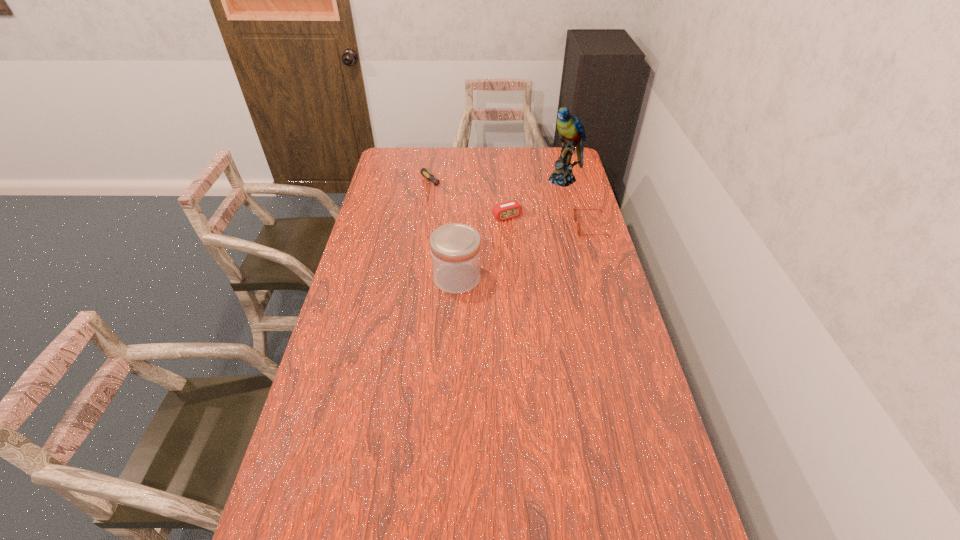
Locate an element on the screen. the fourth shortest object is located at coordinates (455, 248).

Identify the location of jar. This screenshot has height=540, width=960. (455, 248).

Identify the location of sunglasses. This screenshot has height=540, width=960. (575, 210).

You are a GUI agent. You are given a task and a screenshot of the screen. Output one action in this format:
    pyautogui.click(x=<x>, y=<y>)
    Task: Click on the screwdriver
    
    Given the screenshot: What is the action you would take?
    pyautogui.click(x=429, y=176)

This screenshot has height=540, width=960. In order to click on alarm clock in this screenshot , I will do `click(511, 209)`.

This screenshot has width=960, height=540. Identify the location of the third object from left to right. (511, 209).

Image resolution: width=960 pixels, height=540 pixels. I want to click on the tallest object, so click(571, 131).

Identify the location of blank area located on the right of the nearest object. This screenshot has height=540, width=960. (592, 278).

I want to click on vacant space located on the face of the fourth tallest object, so click(x=501, y=227).

Identify the location of vacant region located 0.170m on the face of the fourth tallest object. (534, 227).